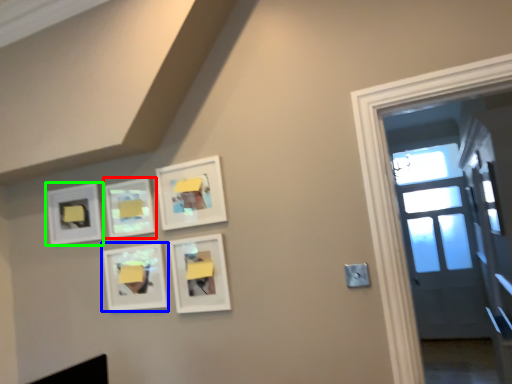
Question: Considering the real-world distances, which object is closest to picture frame (highlighted by a red box)? picture frame (highlighted by a blue box) or picture frame (highlighted by a green box).

Choices:
 (A) picture frame
 (B) picture frame

Answer: (A)